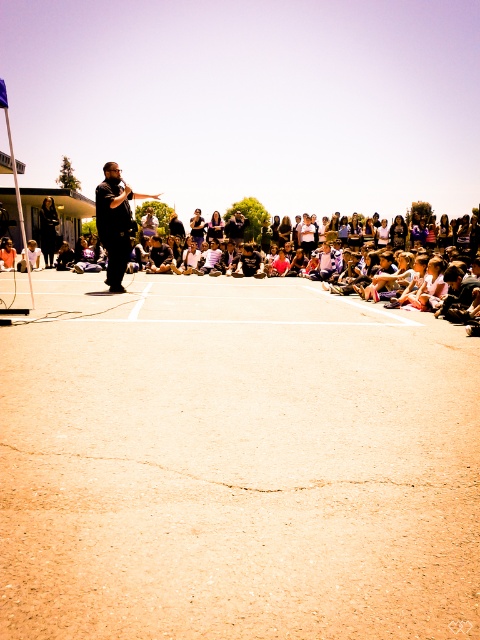
Does black matte shirt at center appear on the right side of black fabric at center?

Correct, you'll find black matte shirt at center to the right of black fabric at center.

Between point (127, 237) and point (44, 256), which one is positioned in front?

Point (127, 237) is more forward.

Does point (106, 177) come in front of point (40, 237)?

Yes, point (106, 177) is in front of point (40, 237).

Where is `black matte shirt at center`? This screenshot has height=640, width=480. black matte shirt at center is located at coordinates pos(115,221).

Can you confirm if black fabric at center is positioned to the left of white cotton shirt at center?

Correct, you'll find black fabric at center to the left of white cotton shirt at center.

Which is behind, point (49, 228) or point (192, 227)?

The point (192, 227) is more distant.

Find the location of a particular element. Image resolution: width=480 pixels, height=640 pixels. black fabric at center is located at coordinates point(48,228).

Is black matte shirt at center closer to the viewer compared to white cotton shirt at center?

Yes, black matte shirt at center is in front of white cotton shirt at center.

Where is `black matte shirt at center`? The width and height of the screenshot is (480, 640). black matte shirt at center is located at coordinates (115, 221).